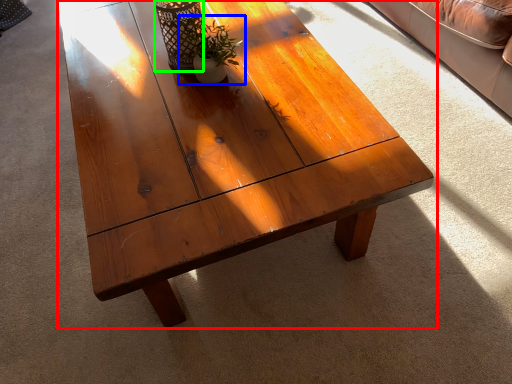
Question: Which object is the farthest from coffee table (highlighted by a red box)? Choose among these: houseplant (highlighted by a blue box) or glass vase (highlighted by a green box).

Choices:
 (A) houseplant
 (B) glass vase

Answer: (B)